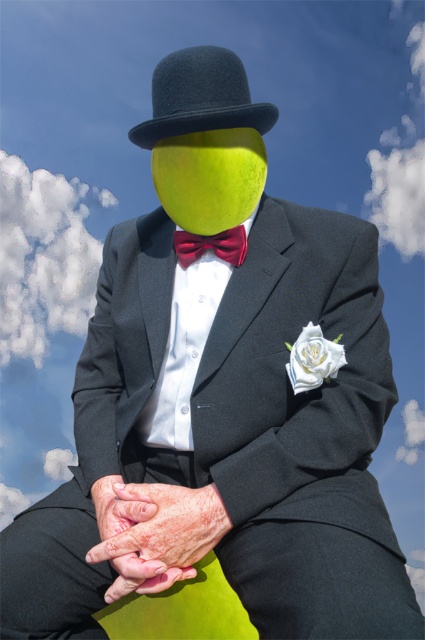
You are a tailor measuring the distance between the black felt fedora at center and the shiny red bow tie at center for a custom suit. The minimum required distance for proper fitting is 12 inches. Can the current distance accommodate the fitting requirements?

The black felt fedora at center is 13.55 inches away from the shiny red bow tie at center, which exceeds the minimum required distance of 12 inches. Therefore, the current distance can accommodate the fitting requirements.

You are a tailor measuring accessories for a formal event. You need to determine which of the two accessories, the black felt fedora at center or the shiny red bow tie at center, requires a taller storage compartment. Based on the image, which one should you allocate more vertical space for?

The black felt fedora at center requires more vertical space because it has a greater height compared to the shiny red bow tie at center.